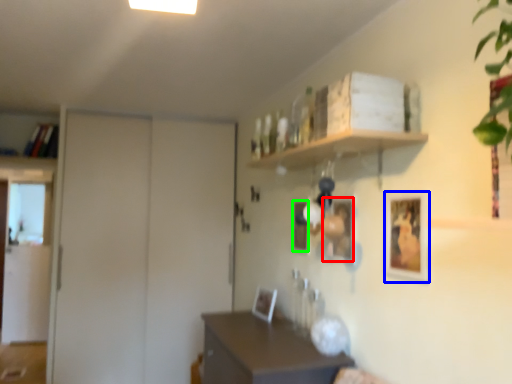
Question: Based on their relative distances, which object is farther from picture frame (highlighted by a red box)? Choose from picture frame (highlighted by a blue box) and picture frame (highlighted by a green box).

Choices:
 (A) picture frame
 (B) picture frame

Answer: (B)